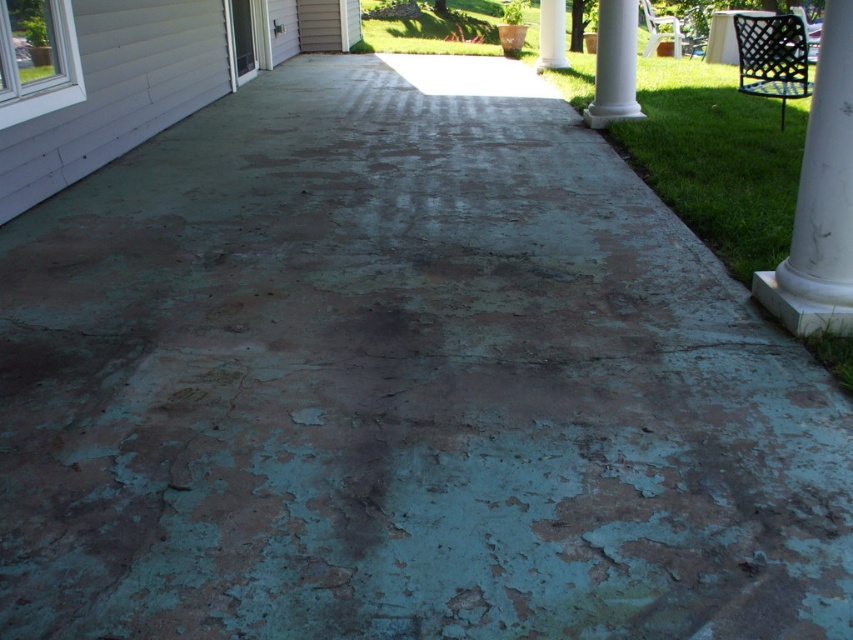
Is white marble pillar at right in front of white smooth column at upper center?

Yes, white marble pillar at right is in front of white smooth column at upper center.

Is point (782, 269) farther from camera compared to point (596, 12)?

No.

Between point (782, 320) and point (602, 22), which one is positioned in front?

Point (782, 320)

In order to click on white marble pillar at right in this screenshot , I will do `click(820, 198)`.

Between white marble pillar at right and white smooth column at center, which one has less height?

With less height is white smooth column at center.

Does point (850, 17) come closer to viewer compared to point (543, 26)?

Yes, it is in front of point (543, 26).

You are a GUI agent. You are given a task and a screenshot of the screen. Output one action in this format:
    pyautogui.click(x=<x>, y=<y>)
    Task: Click on the white marble pillar at right
    The height and width of the screenshot is (640, 853).
    Given the screenshot: What is the action you would take?
    pyautogui.click(x=820, y=198)

Who is positioned more to the left, white smooth column at upper center or white smooth column at center?

white smooth column at upper center is more to the left.

Which of these two, white smooth column at upper center or white smooth column at center, stands taller?

white smooth column at upper center is taller.

Does point (605, 60) lie behind point (550, 60)?

No, (605, 60) is closer to viewer.

At what (x,y) coordinates should I click in order to perform the action: click on white smooth column at upper center. Please return your answer as a coordinate pair (x, y). Looking at the image, I should click on (614, 65).